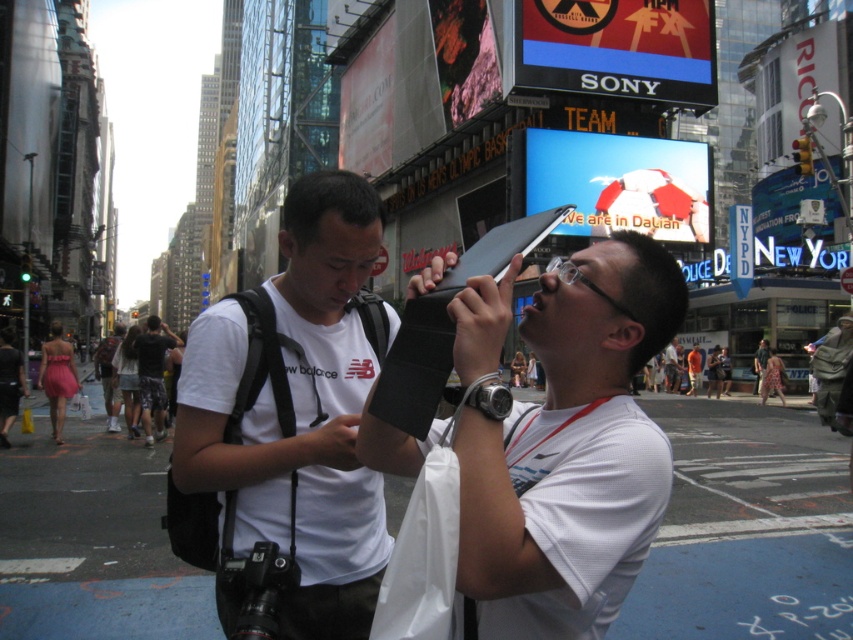
Question: Can you confirm if black matte wallet at center is positioned below dark gray shorts at center?

Choices:
 (A) yes
 (B) no

Answer: (B)

Question: Which object is closer to the camera taking this photo?

Choices:
 (A) white matte t-shirt at center
 (B) black matte wallet at center
 (C) dark gray shorts at center
 (D) white cotton t-shirt at center

Answer: (B)

Question: Estimate the real-world distances between objects in this image. Which object is closer to the black matte wallet at center?

Choices:
 (A) white matte t-shirt at center
 (B) white cotton t-shirt at center
 (C) dark gray shorts at center

Answer: (A)

Question: Can you confirm if dark gray shorts at center is positioned to the right of white cotton t-shirt at center?

Choices:
 (A) no
 (B) yes

Answer: (B)

Question: Which object is farther from the camera taking this photo?

Choices:
 (A) white matte t-shirt at center
 (B) dark gray shorts at center
 (C) black matte wallet at center

Answer: (B)

Question: Is the position of white matte t-shirt at center more distant than that of white cotton t-shirt at center?

Choices:
 (A) no
 (B) yes

Answer: (A)